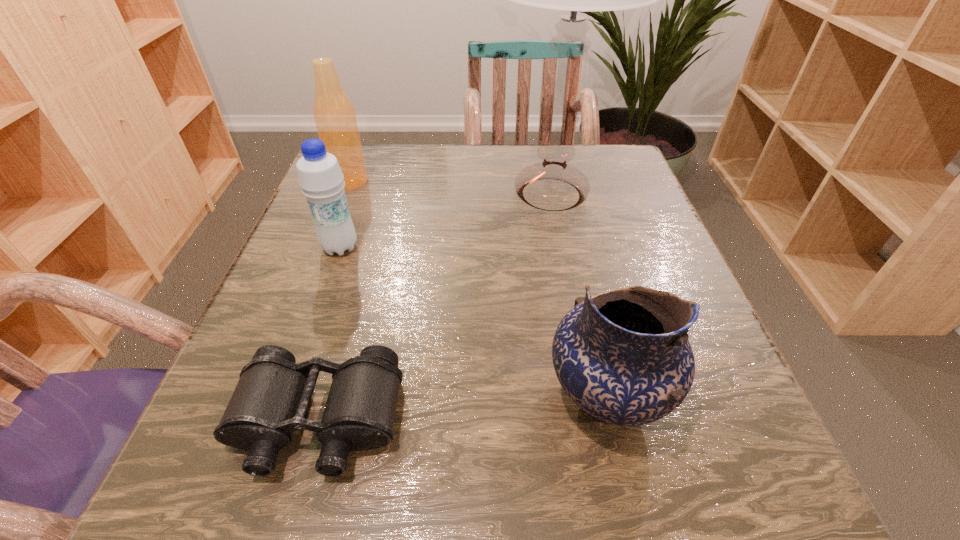
This screenshot has width=960, height=540. Find the location of `the tallest object`. the tallest object is located at coordinates (552, 185).

Locate an element on the screen. beer bottle is located at coordinates (334, 115).

Where is `the third nearest object`? the third nearest object is located at coordinates (320, 177).

The width and height of the screenshot is (960, 540). Identify the location of pottery. (623, 356).

Identify the location of binoculars. This screenshot has height=540, width=960. (271, 399).

Find the location of a particular element. free space located on the front-facing side of the tallest object is located at coordinates (564, 259).

This screenshot has width=960, height=540. I want to click on vacant area situated on the right of the second tallest object, so click(501, 181).

Where is `vacant space located 0.160m on the back of the third farthest object`? This screenshot has height=540, width=960. vacant space located 0.160m on the back of the third farthest object is located at coordinates (360, 190).

I want to click on vacant space located 0.300m on the back of the pottery, so click(x=566, y=226).

What are the coordinates of `table lamp that is at the far edge` in the screenshot? It's located at (552, 185).